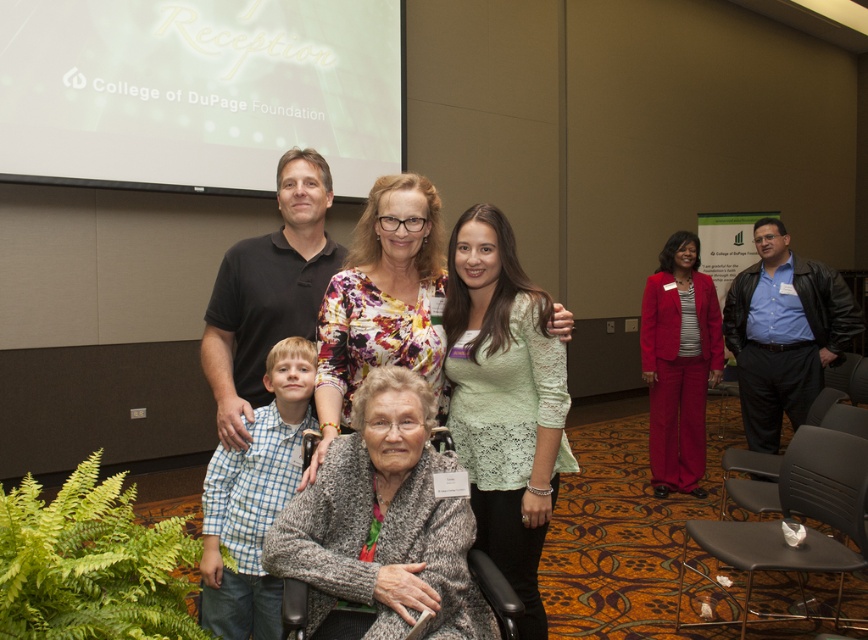
Is the position of white matte projection screen at upper center less distant than that of floral fabric blouse at center?

No, it is not.

Which is more to the right, white matte projection screen at upper center or floral fabric blouse at center?

floral fabric blouse at center

The height and width of the screenshot is (640, 868). Describe the element at coordinates (199, 92) in the screenshot. I see `white matte projection screen at upper center` at that location.

Locate an element on the screen. white matte projection screen at upper center is located at coordinates (199, 92).

Is white matte projection screen at upper center to the left of gray knitted sweater at center from the viewer's perspective?

Indeed, white matte projection screen at upper center is positioned on the left side of gray knitted sweater at center.

The height and width of the screenshot is (640, 868). What do you see at coordinates (199, 92) in the screenshot?
I see `white matte projection screen at upper center` at bounding box center [199, 92].

Locate an element on the screen. The width and height of the screenshot is (868, 640). white matte projection screen at upper center is located at coordinates (199, 92).

Find the location of a particular element. This screenshot has width=868, height=640. lace fabric sweater at center is located at coordinates (504, 397).

Does point (458, 445) come behind point (669, 333)?

No, (458, 445) is closer to viewer.

I want to click on lace fabric sweater at center, so click(504, 397).